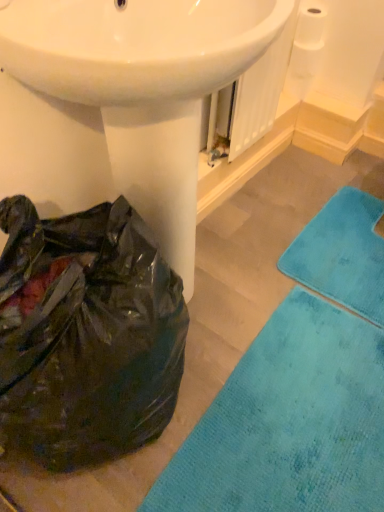
Question: Is point (153, 18) positioned closer to the camera than point (377, 318)?

Choices:
 (A) closer
 (B) farther

Answer: (A)

Question: Considering the relative positions of white glossy sink at center and teal plush bath towel at lower right in the image provided, is white glossy sink at center to the left or to the right of teal plush bath towel at lower right?

Choices:
 (A) right
 (B) left

Answer: (B)

Question: Which is farther from the white glossy sink at center?

Choices:
 (A) teal plush bath towel at lower right
 (B) black plastic bag at lower left
 (C) white matte toilet paper at upper right
 (D) teal soft rug at lower right

Answer: (C)

Question: Considering the real-world distances, which object is closest to the teal plush bath towel at lower right?

Choices:
 (A) black plastic bag at lower left
 (B) white matte toilet paper at upper right
 (C) white glossy sink at center
 (D) teal soft rug at lower right

Answer: (D)